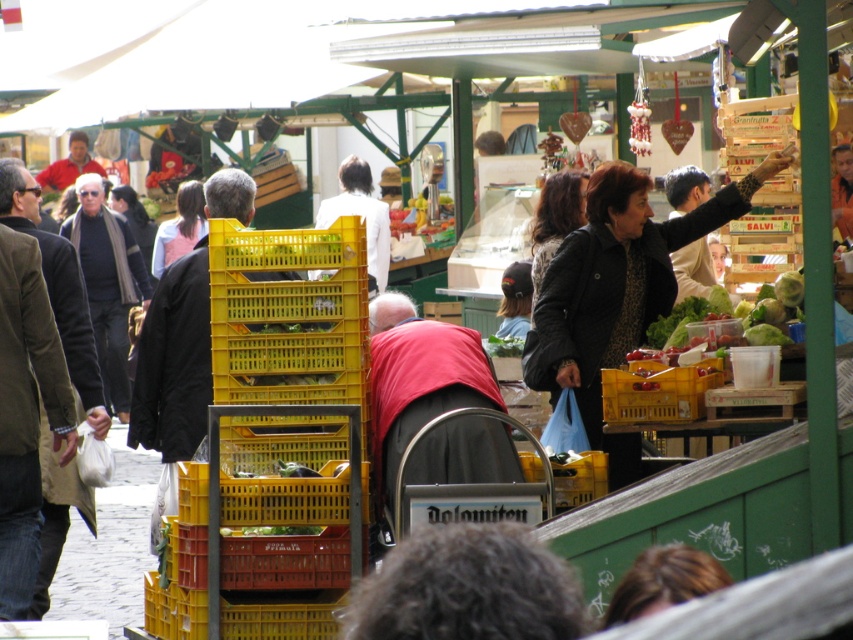
Locate an element on the screen. black textured coat at upper right is located at coordinates (616, 291).

Is the position of black textured coat at upper right more distant than that of yellow plastic crate at center?

Yes, it is.

Image resolution: width=853 pixels, height=640 pixels. Find the location of `black textured coat at upper right`. black textured coat at upper right is located at coordinates (616, 291).

Can you confirm if yellow plastic crate at center is positioned to the right of matte black jacket at center?

Indeed, yellow plastic crate at center is positioned on the right side of matte black jacket at center.

Can you confirm if yellow plastic crate at center is smaller than matte black jacket at center?

Indeed, yellow plastic crate at center has a smaller size compared to matte black jacket at center.

Is point (686, 412) less distant than point (171, 230)?

Yes, it is.

Find the location of a particular element. yellow plastic crate at center is located at coordinates pos(657,392).

Who is lower down, black textured coat at upper right or matte black jacket at center?

black textured coat at upper right is below.

Is point (630, 444) positioned before point (193, 216)?

That is True.

Locate an element on the screen. The image size is (853, 640). black textured coat at upper right is located at coordinates (616, 291).